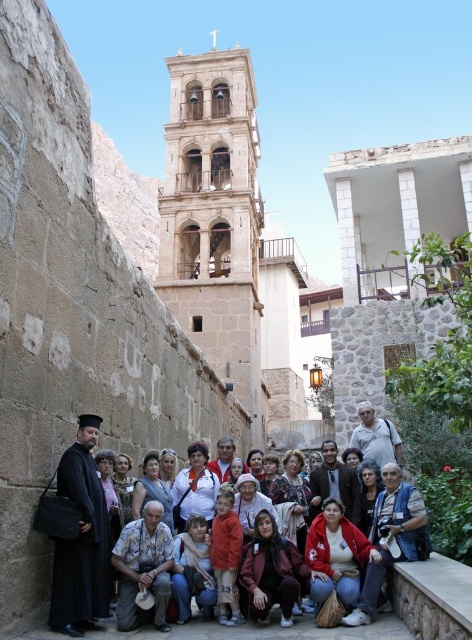
You are standing at point (68,522) and want to take a photo of the group. The camera you have can focus on subjects within 20 meters. Will you be able to capture the group clearly?

The distance between point (68,522) and the camera is 19.78 meters, which is within the camera focus range of 20 meters. Therefore, you can capture the group clearly.

You are a photographer adjusting the camera settings for a group photo. You notice two robes in the frame. The black matte robe at left and the dark red fabric robe at center. Which robe should you focus on first if you want to ensure both are in focus, considering their heights?

The black matte robe at left is not as tall as the dark red fabric robe at center, so you should focus on the dark red fabric robe at center first to ensure both are in focus.

You are a photographer trying to capture the group photo. You want to ensure that the red fleece jacket at lower center is centered in the frame. Given that the camera has a 16x9 aspect ratio, what adjustment should you make to the camera position or framing?

Since the red fleece jacket at lower center is located at coordinates point (336, 556), which is towards the right and lower part of the frame, you should move the camera slightly to the right and upward to center it within the 16x9 aspect ratio.